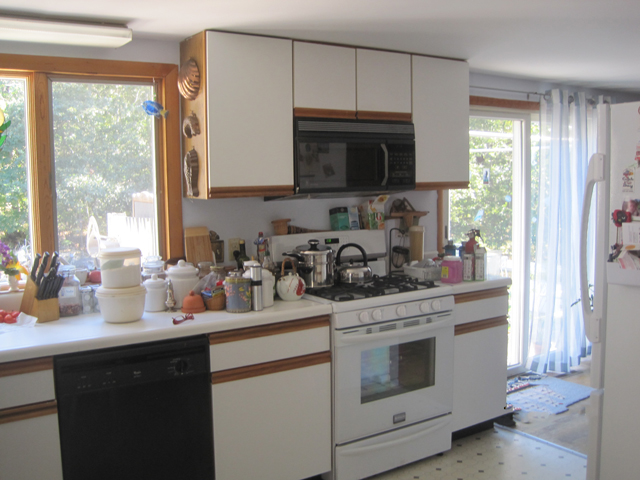
Find the location of a particular element. The width and height of the screenshot is (640, 480). floor is located at coordinates (509, 442).